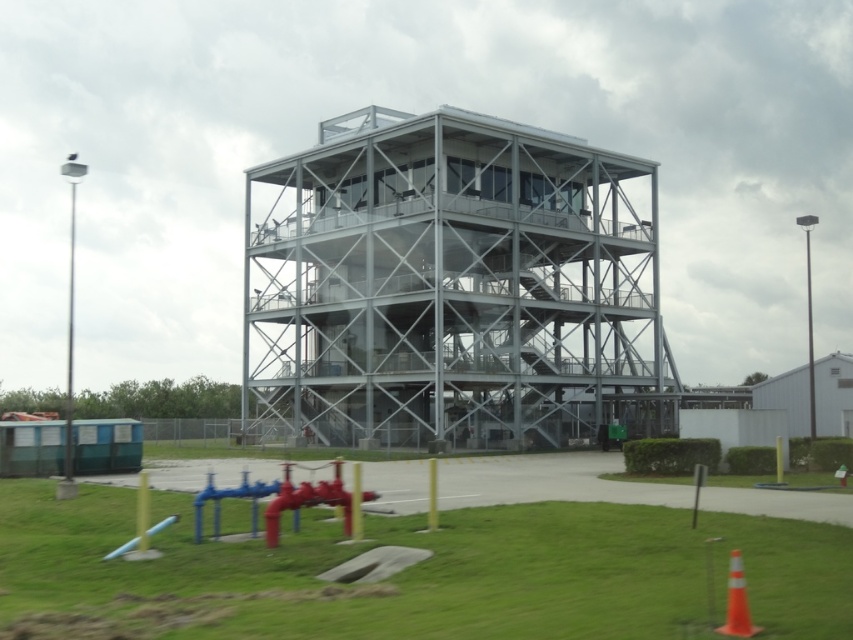
Is metallic structure at center thinner than orange plastic cone at lower right?

Incorrect, metallic structure at center's width is not less than orange plastic cone at lower right's.

Is point (613, 227) positioned before point (734, 605)?

That is False.

Locate an element on the screen. The height and width of the screenshot is (640, 853). metallic structure at center is located at coordinates (451, 289).